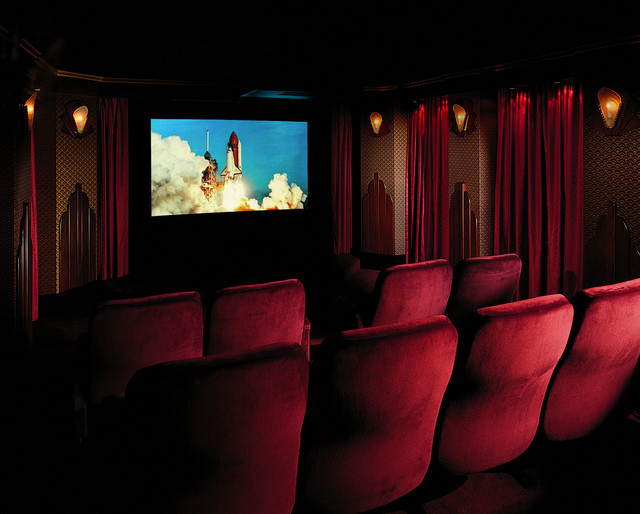
Find the location of a particular element. This screenshot has width=640, height=514. chair is located at coordinates (164, 328), (274, 318), (406, 307), (484, 289), (611, 325), (516, 361), (400, 403), (260, 437).